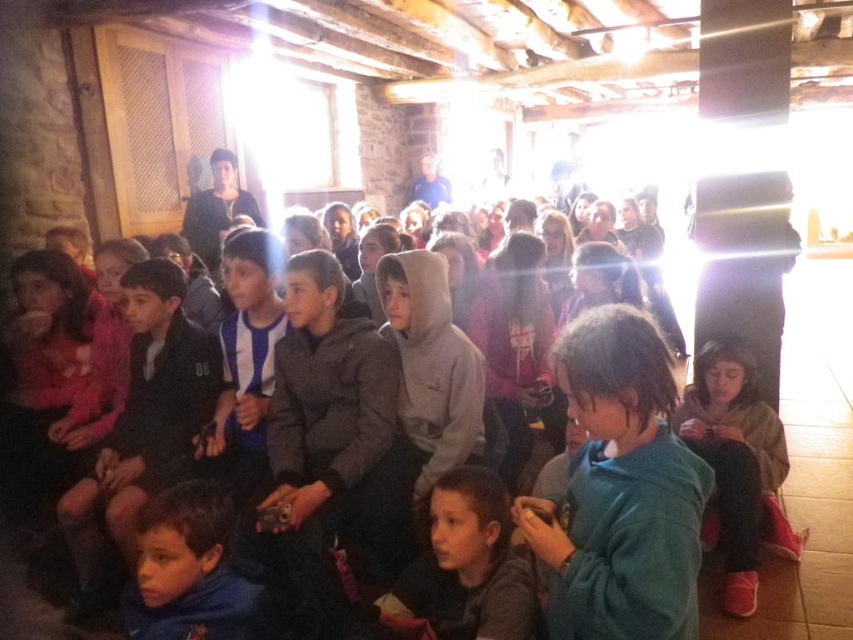
You are a photographer trying to capture a group shot of the children. You want to ensure both the brown fuzzy jacket at lower right and the gray hoodie at center are visible in the frame. Based on their positions, which child should you position closer to the center of the photo to include both?

Since the brown fuzzy jacket at lower right is to the right of the gray hoodie at center, you should position the gray hoodie at center closer to the center of the photo to ensure both are visible.

You are a tailor who needs to determine which jacket requires more fabric to make between the green fleece jacket at center and the brown fuzzy jacket at lower right. Based on the image, which one would need more fabric?

The brown fuzzy jacket at lower right requires more fabric because it is thicker than the green fleece jacket at center.

You are a photographer trying to capture a group shot of the children. You notice the green fleece jacket at center and the brown fuzzy jacket at lower right. Which jacket should you focus on if you want to ensure both jackets are in the frame without moving the camera?

The green fleece jacket at center is positioned on the left side of brown fuzzy jacket at lower right, so focusing on the brown fuzzy jacket at lower right would center the frame between both jackets, ensuring both are included.